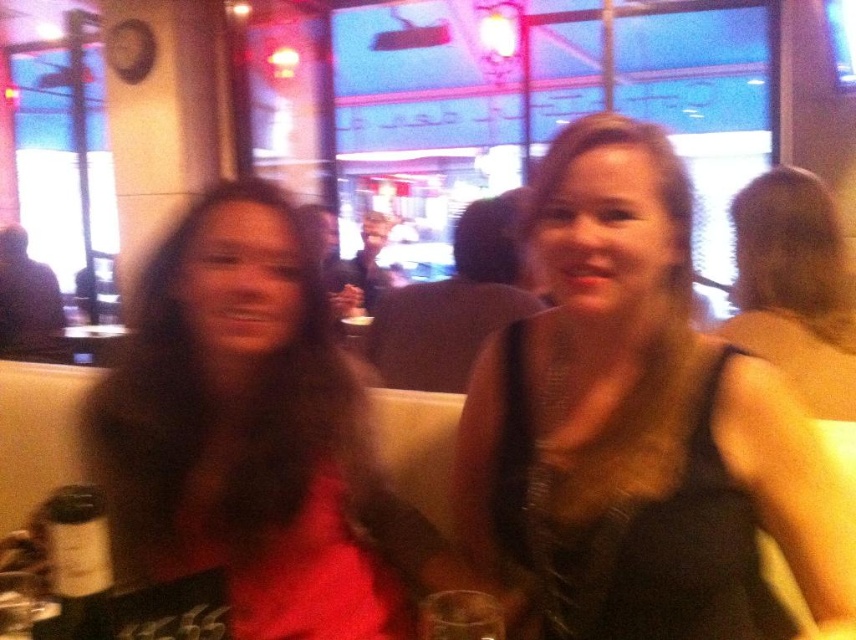
You are a photographer adjusting your camera settings to focus on the black sequined dress at center and the dark brown glass bottle at lower left. Based on their positions, which object should you prioritize focusing on to ensure clarity in the final photo?

The black sequined dress at center is located above the dark brown glass bottle at lower left, so prioritizing focus on the black sequined dress at center would ensure it appears clearer in the photo due to its position in the frame.